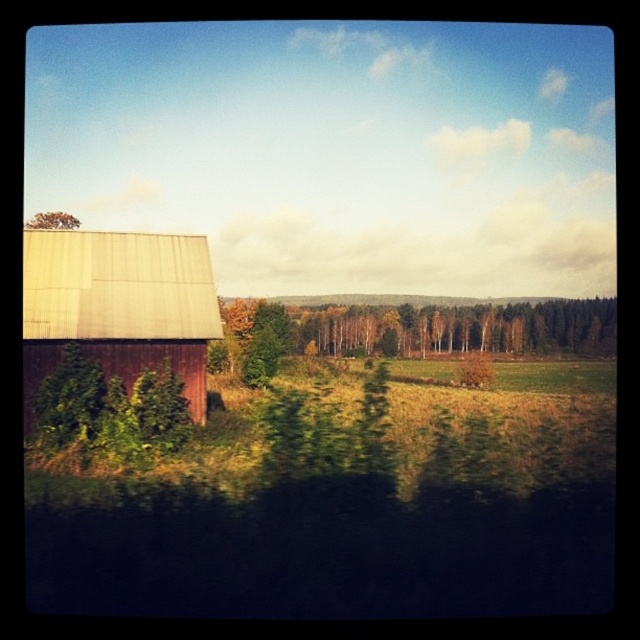
You are standing in the rural landscape and want to walk towards both the green leafy tree at center and the brown textured tree at upper left. Which tree will you reach first?

You will reach the green leafy tree at center first because it is closer to you than the brown textured tree at upper left, which is further away.

You are a hiker standing in the field looking towards the barn. You see the green leafy tree at center and the brown textured tree at upper left. Which tree is closer to you?

The green leafy tree at center is closer to you because it is located below the brown textured tree at upper left, indicating it is in a lower position within the scene.